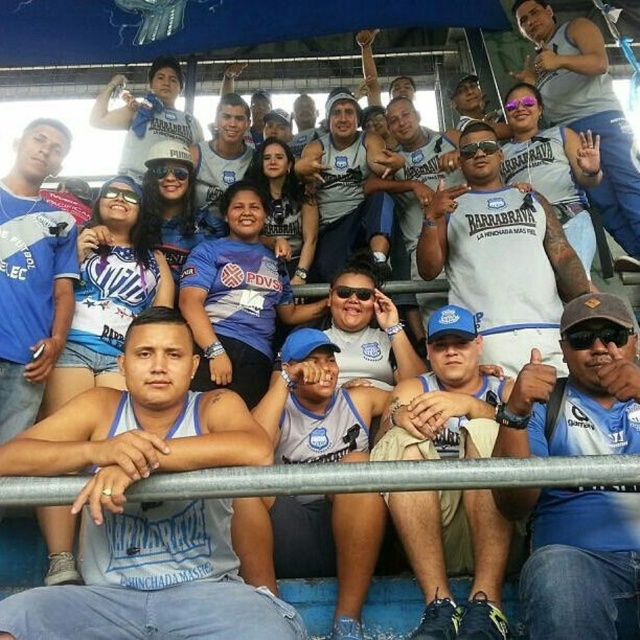
Question: Does blue fabric shirt at lower right appear over matte gray shirt at center?

Choices:
 (A) yes
 (B) no

Answer: (B)

Question: Estimate the real-world distances between objects in this image. Which object is closer to the white cotton t-shirt at upper center?

Choices:
 (A) matte gray shirt at center
 (B) white matte t-shirt at center
 (C) matte blue shirt at upper center
 (D) matte blue shirt at center

Answer: (B)

Question: Is white cotton t-shirt at upper center bigger than matte blue shirt at upper center?

Choices:
 (A) no
 (B) yes

Answer: (A)

Question: Is blue fabric shirt at lower right bigger than matte blue shirt at upper center?

Choices:
 (A) yes
 (B) no

Answer: (B)

Question: Which object is farther from the camera taking this photo?

Choices:
 (A) white jersey at center
 (B) white cotton t-shirt at upper center
 (C) blue fabric cap at center

Answer: (B)

Question: Which point is farther from the camera taking this photo?

Choices:
 (A) (99, 100)
 (B) (477, 625)

Answer: (A)